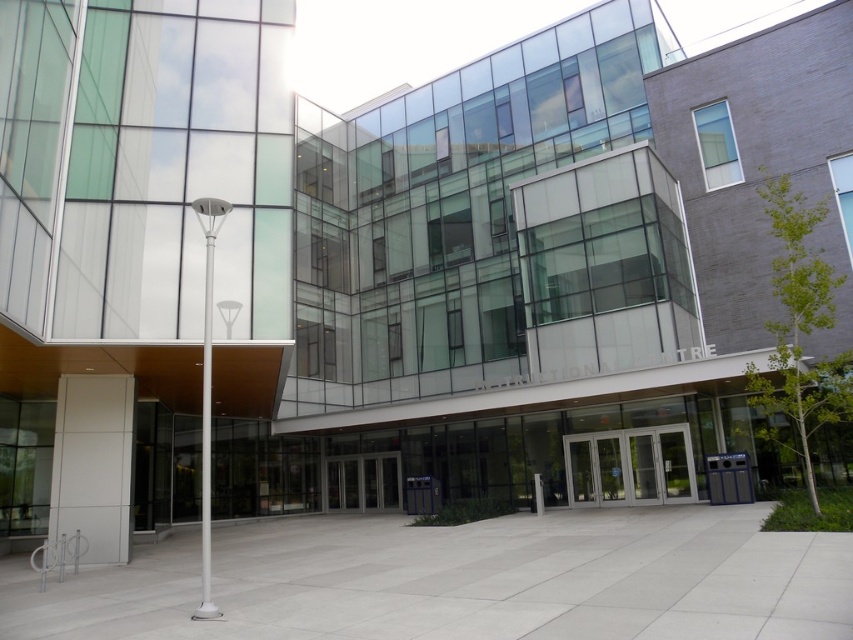
Question: Among these objects, which one is farthest from the camera?

Choices:
 (A) metallic glass doors at center
 (B) silver metallic doors at center

Answer: (A)

Question: Is silver metallic doors at center positioned in front of metallic glass doors at center?

Choices:
 (A) yes
 (B) no

Answer: (A)

Question: Is silver metallic doors at center to the right of metallic glass doors at center from the viewer's perspective?

Choices:
 (A) no
 (B) yes

Answer: (B)

Question: Does silver metallic doors at center appear on the left side of metallic glass doors at center?

Choices:
 (A) no
 (B) yes

Answer: (A)